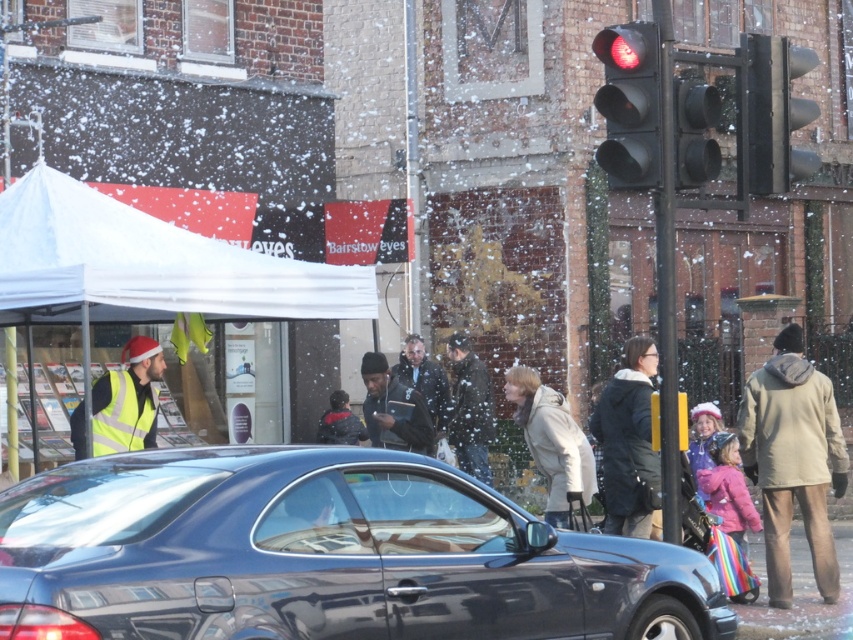
From the picture: You are a delivery person needing to park your vehicle near the black glass traffic light at upper right. The parking space you found is 15 feet away from the glossy metallic car at center. Is this parking space within the legal distance required by traffic rules?

The distance between the glossy metallic car at center and the black glass traffic light at upper right is 12.03 feet. Since the parking space is 15 feet away from the car, it would place the parking space beyond the traffic light, which may violate parking regulations near traffic lights. Check local rules for exact distances.